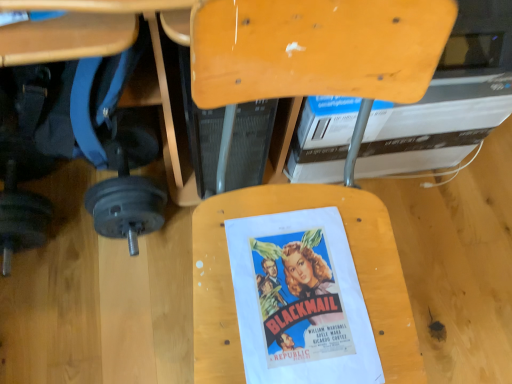
What are the coordinates of `white cardboard book at upper center` in the screenshot? It's located at (434, 125).

Locate an element on the screen. Image resolution: width=512 pixels, height=384 pixels. matte paper movie poster at center is located at coordinates (300, 300).

Is white cardboard book at upper center to the left or to the right of wooden chair at center in the image?

In the image, white cardboard book at upper center appears on the right side of wooden chair at center.

From a real-world perspective, which is physically below, white cardboard book at upper center or wooden chair at center?

In real-world perspective, white cardboard book at upper center is lower.

Between white cardboard book at upper center and wooden chair at center, which one has smaller size?

wooden chair at center.

Is white cardboard book at upper center turned away from wooden chair at center?

No, white cardboard book at upper center is not facing away from wooden chair at center.

Is wooden chair at center beside brushed metal dumbbell at lower left?

No.

Can you confirm if wooden chair at center is wider than brushed metal dumbbell at lower left?

Yes, wooden chair at center is wider than brushed metal dumbbell at lower left.

In the scene shown: Is wooden chair at center completely or partially outside of brushed metal dumbbell at lower left?

wooden chair at center is positioned outside brushed metal dumbbell at lower left.

Which object is positioned more to the right, white cardboard book at upper center or brushed metal dumbbell at lower left?

Positioned to the right is white cardboard book at upper center.

Is white cardboard book at upper center turned away from brushed metal dumbbell at lower left?

No.

What are the coordinates of `paperback book above the brushed metal dumbbell at lower left (from the image's perspective)` in the screenshot? It's located at (434, 125).

From the image's perspective, which is above, matte paper movie poster at center or wooden chair at center?

From the image's view, wooden chair at center is above.

Which is more to the left, matte paper movie poster at center or wooden chair at center?

From the viewer's perspective, wooden chair at center appears more on the left side.

From a real-world perspective, is matte paper movie poster at center above or below wooden chair at center?

Clearly, from a real-world perspective, matte paper movie poster at center is above wooden chair at center.

In terms of height, does matte paper movie poster at center look taller or shorter compared to wooden chair at center?

matte paper movie poster at center is shorter than wooden chair at center.

Does matte paper movie poster at center turn towards brushed metal dumbbell at lower left?

No.

Is matte paper movie poster at center next to brushed metal dumbbell at lower left and touching it?

No, matte paper movie poster at center is not making contact with brushed metal dumbbell at lower left.

Does matte paper movie poster at center have a greater width compared to brushed metal dumbbell at lower left?

In fact, matte paper movie poster at center might be narrower than brushed metal dumbbell at lower left.

Which of these two, white cardboard book at upper center or matte paper movie poster at center, stands taller?

Standing taller between the two is white cardboard book at upper center.

Is white cardboard book at upper center to the right of matte paper movie poster at center from the viewer's perspective?

Indeed, white cardboard book at upper center is positioned on the right side of matte paper movie poster at center.

Which object is wider, white cardboard book at upper center or matte paper movie poster at center?

white cardboard book at upper center.

Who is more distant, wooden chair at center or white cardboard book at upper center?

Positioned behind is white cardboard book at upper center.

Considering the sizes of wooden chair at center and white cardboard book at upper center in the image, is wooden chair at center wider or thinner than white cardboard book at upper center?

In the image, wooden chair at center appears to be more narrow than white cardboard book at upper center.

Are wooden chair at center and white cardboard book at upper center making contact?

No, wooden chair at center is not making contact with white cardboard book at upper center.

Identify the location of chair lying in front of the white cardboard book at upper center. (316, 48).

Identify the location of chair above the white cardboard book at upper center (from a real-world perspective). (316, 48).

The image size is (512, 384). What are the coordinates of `table on the left of wooden chair at center` in the screenshot? It's located at (117, 50).

Considering their positions, is brushed metal dumbbell at lower left positioned closer to white cardboard book at upper center than wooden chair at center?

wooden chair at center is closer to white cardboard book at upper center.

Considering their positions, is wooden chair at center positioned closer to brushed metal dumbbell at lower left than matte paper movie poster at center?

Among the two, wooden chair at center is located nearer to brushed metal dumbbell at lower left.

Looking at this image, looking at the image, which one is located closer to matte paper movie poster at center, brushed metal dumbbell at lower left or wooden chair at center?

wooden chair at center is closer to matte paper movie poster at center.

From the image, which object appears to be nearer to matte paper movie poster at center, white cardboard book at upper center or wooden chair at center?

wooden chair at center is positioned closer to the anchor matte paper movie poster at center.

Considering their positions, is matte paper movie poster at center positioned further to white cardboard book at upper center than wooden chair at center?

matte paper movie poster at center.

Based on their spatial positions, is wooden chair at center or matte paper movie poster at center closer to white cardboard book at upper center?

Among the two, wooden chair at center is located nearer to white cardboard book at upper center.

Based on their spatial positions, is white cardboard book at upper center or matte paper movie poster at center further from brushed metal dumbbell at lower left?

Among the two, white cardboard book at upper center is located further to brushed metal dumbbell at lower left.

Looking at this image, looking at the image, which one is located closer to brushed metal dumbbell at lower left, matte paper movie poster at center or white cardboard book at upper center?

The object closer to brushed metal dumbbell at lower left is matte paper movie poster at center.

You are a GUI agent. You are given a task and a screenshot of the screen. Output one action in this format:
    pyautogui.click(x=<x>, y=<y>)
    Task: Click on the chair situated between brushed metal dumbbell at lower left and matte paper movie poster at center from left to right
    The height and width of the screenshot is (384, 512).
    Given the screenshot: What is the action you would take?
    pyautogui.click(x=316, y=48)

Locate an element on the screen. chair that lies between white cardboard book at upper center and matte paper movie poster at center from top to bottom is located at coordinates (316, 48).

This screenshot has height=384, width=512. Find the location of `movie poster between brushed metal dumbbell at lower left and white cardboard book at upper center in the horizontal direction`. movie poster between brushed metal dumbbell at lower left and white cardboard book at upper center in the horizontal direction is located at coordinates (300, 300).

Locate an element on the screen. The image size is (512, 384). chair between brushed metal dumbbell at lower left and white cardboard book at upper center from left to right is located at coordinates (316, 48).